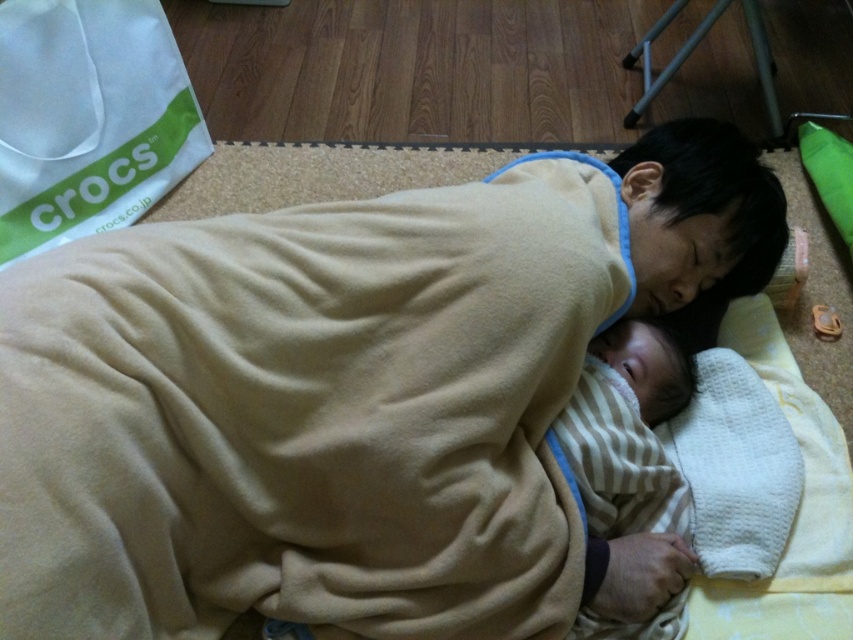
Does point (682, 509) come closer to viewer compared to point (717, 506)?

That is True.

Is striped fabric baby at center above white textured cloth at lower center?

No.

In order to click on striped fabric baby at center in this screenshot , I will do `click(631, 477)`.

Where is `striped fabric baby at center`? striped fabric baby at center is located at coordinates (631, 477).